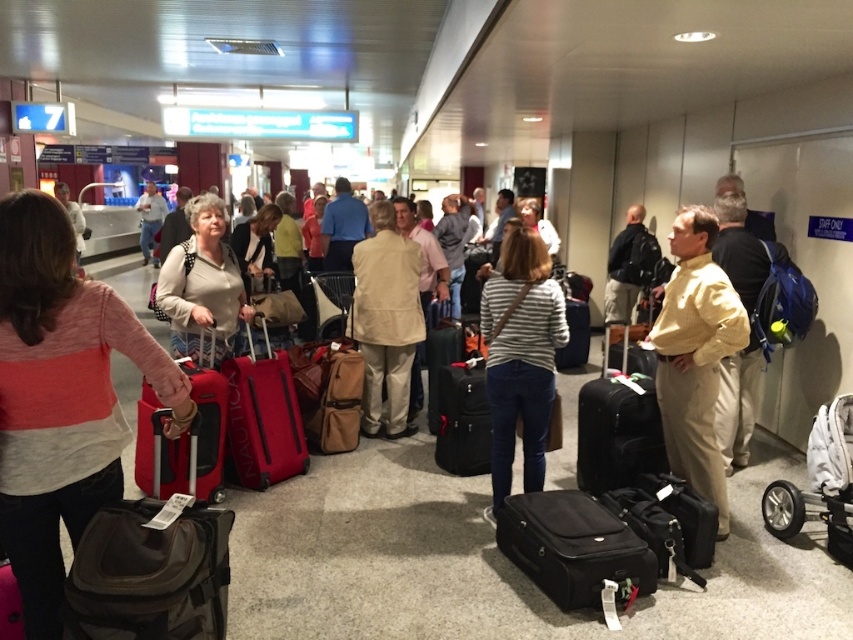
Question: Is striped sweater at left closer to the viewer compared to striped cotton shirt at center?

Choices:
 (A) yes
 (B) no

Answer: (A)

Question: Where is black leather suitcase at lower right located in relation to matte pink shirt at center in the image?

Choices:
 (A) left
 (B) right

Answer: (B)

Question: Which object is closer to the camera taking this photo?

Choices:
 (A) red fabric suitcase at center
 (B) striped sweater at left
 (C) matte beige sweater at center

Answer: (B)

Question: Which of the following is the farthest from the observer?

Choices:
 (A) red fabric suitcase at center
 (B) striped sweater at left
 (C) matte beige sweater at center
 (D) beige fabric coat at center

Answer: (D)

Question: Does matte beige sweater at center appear on the left side of black leather suitcase at lower right?

Choices:
 (A) no
 (B) yes

Answer: (B)

Question: Among these objects, which one is farthest from the camera?

Choices:
 (A) matte beige jacket at center
 (B) matte pink shirt at center
 (C) black hardshell suitcase at center
 (D) beige fabric coat at center

Answer: (B)